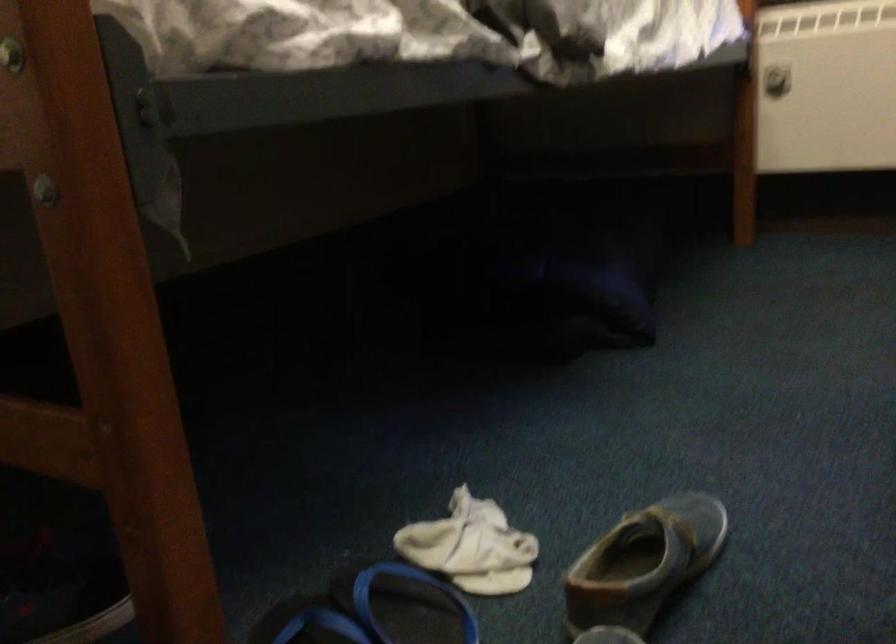
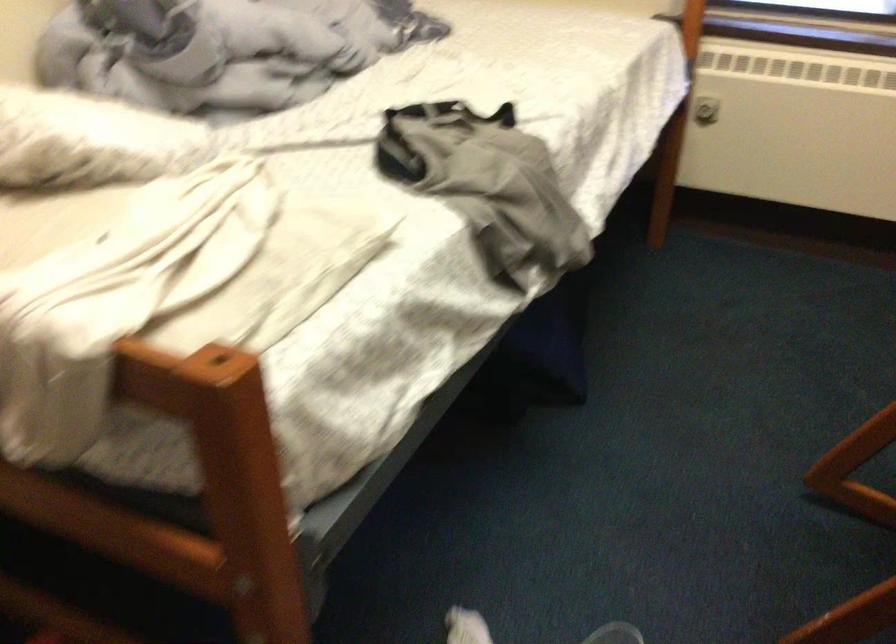
Question: The images are taken continuously from a first-person perspective. In which direction is your viewpoint rotating?

Choices:
 (A) Left
 (B) Right
 (C) Up
 (D) Down

Answer: (D)